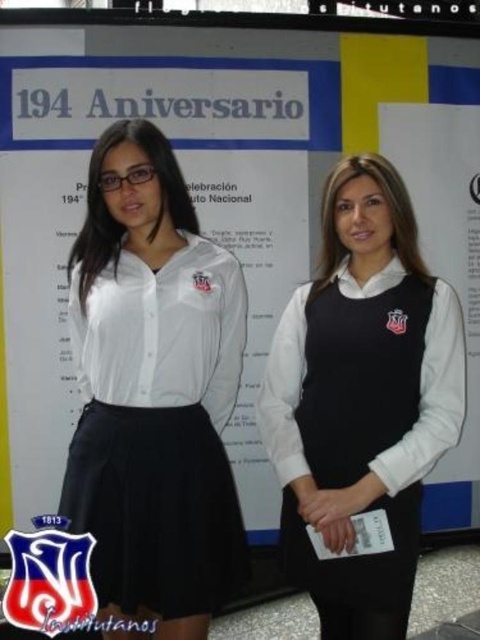
Which is more to the left, white matte shirt at center or black matte vest at center?

Positioned to the left is white matte shirt at center.

Does white matte shirt at center have a smaller size compared to black matte vest at center?

No, white matte shirt at center is not smaller than black matte vest at center.

Locate an element on the screen. The height and width of the screenshot is (640, 480). white matte shirt at center is located at coordinates (154, 390).